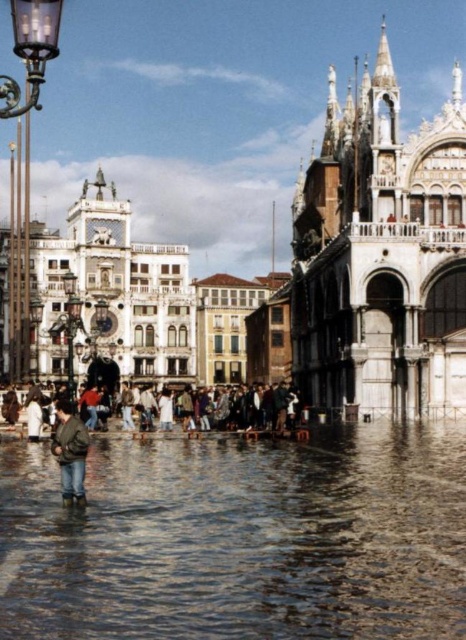
Question: Among these points, which one is nearest to the camera?

Choices:
 (A) (54, 432)
 (B) (362, 243)
 (C) (328, 573)

Answer: (C)

Question: Which of the following is the farthest from the observer?

Choices:
 (A) (1, 509)
 (B) (171, 292)
 (C) (6, 429)
 (D) (433, 227)

Answer: (B)

Question: Which object is the closest to the green matte jacket at lower left?

Choices:
 (A) matte green jacket at center
 (B) white marble palace at right

Answer: (A)

Question: Considering the relative positions of white marble palace at right and white marble palace at center in the image provided, where is white marble palace at right located with respect to white marble palace at center?

Choices:
 (A) left
 (B) right

Answer: (B)

Question: Can you confirm if clear water at lower center is bigger than white marble palace at center?

Choices:
 (A) yes
 (B) no

Answer: (B)

Question: Is clear water at lower center thinner than white marble palace at right?

Choices:
 (A) no
 (B) yes

Answer: (A)